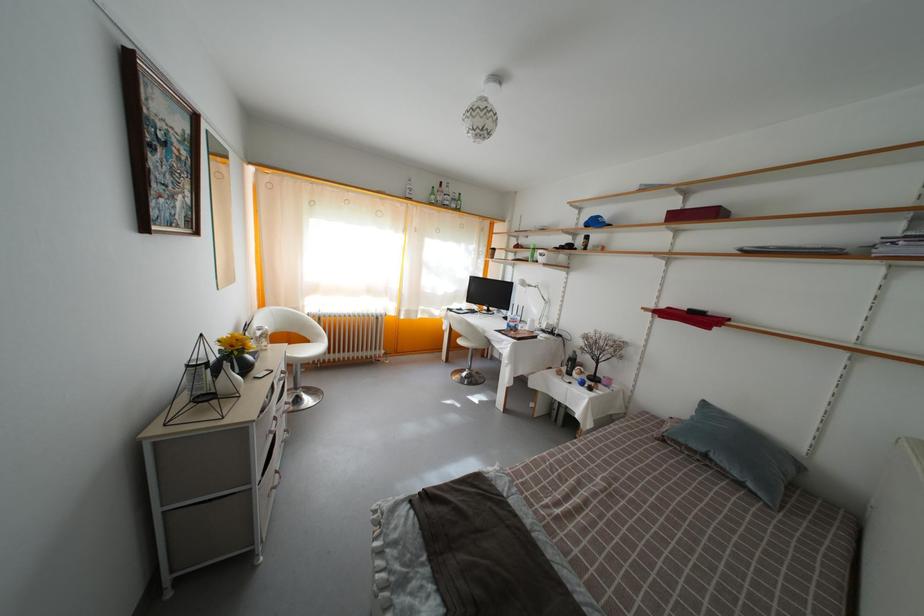
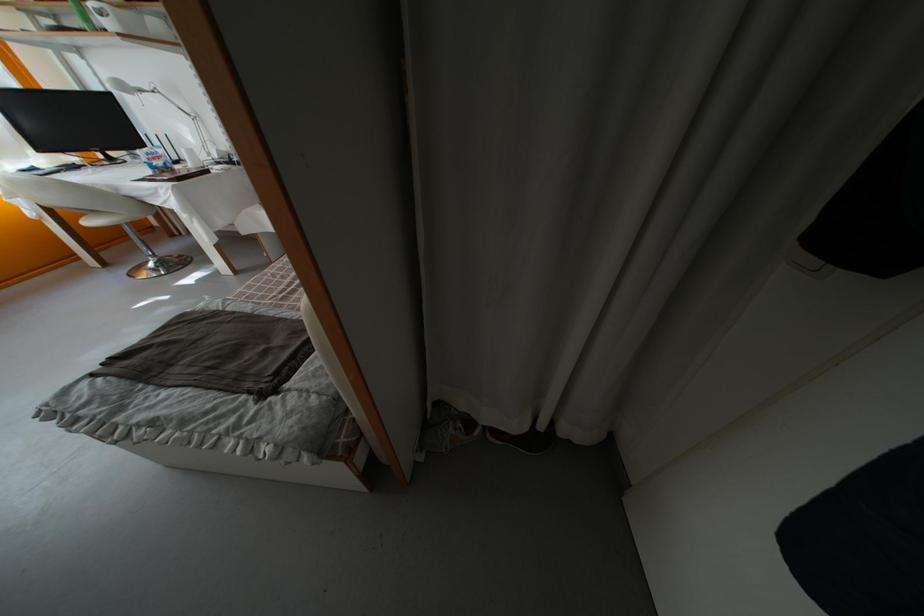
Find the pixel in the second image that matches [466,342] in the first image.

(84, 221)